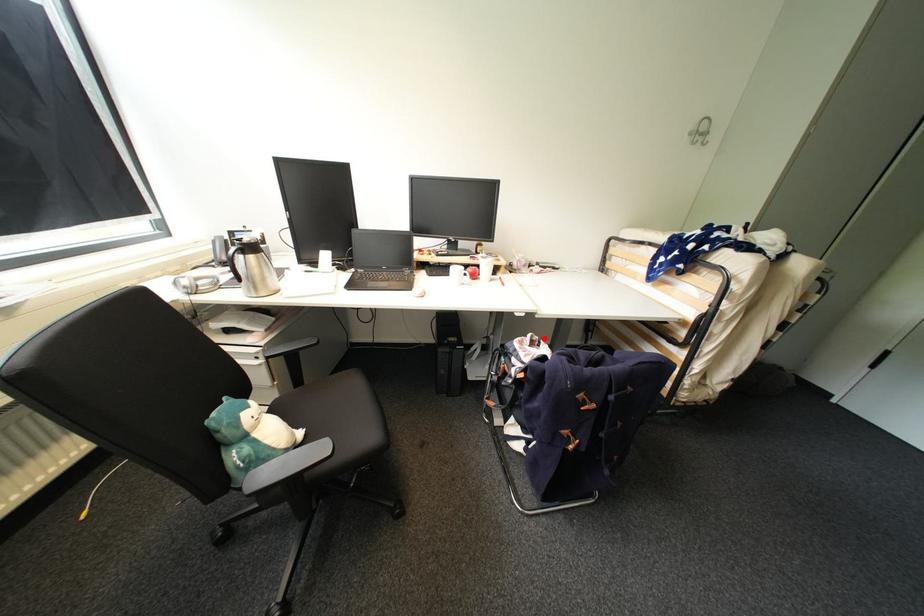
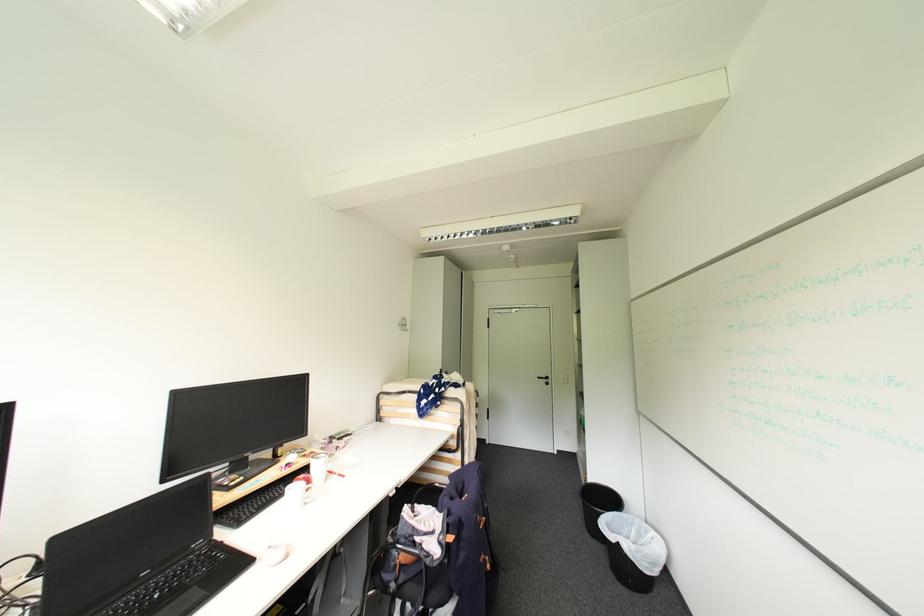
Find the pixel in the second image that matches the highlighted location in the first image.

(417, 506)